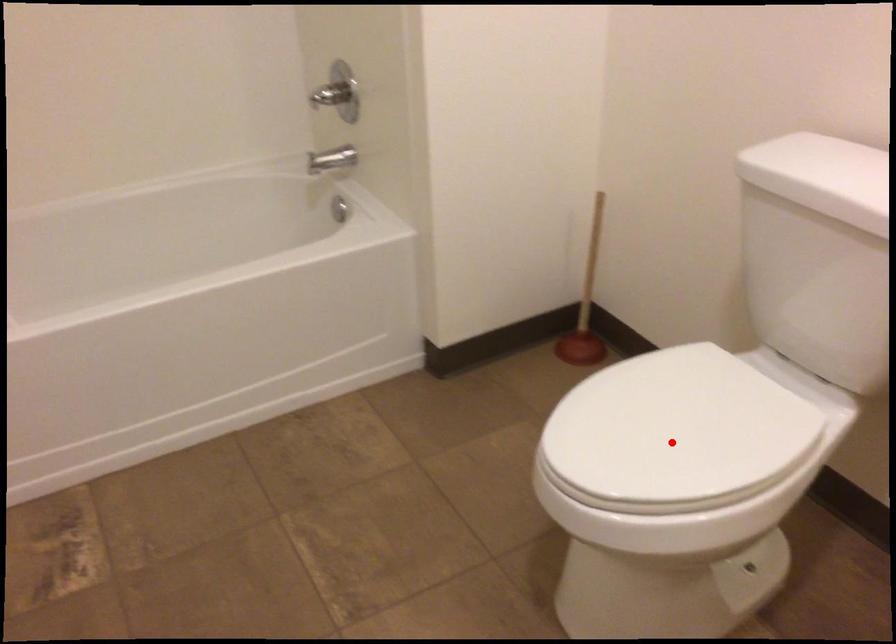
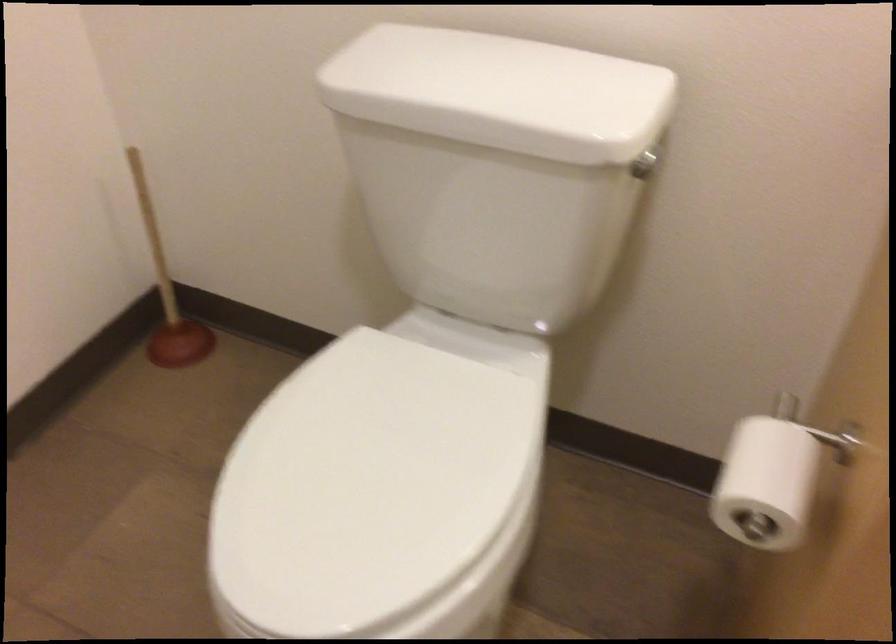
Find the pixel in the second image that matches the highlighted location in the first image.

(376, 496)